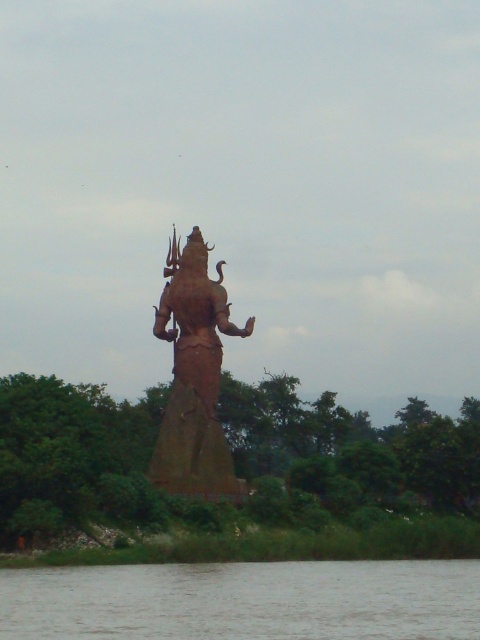
Question: Does brown water at lower center appear on the left side of rusty metal statue at center?

Choices:
 (A) no
 (B) yes

Answer: (A)

Question: Is green leafy tree at center thinner than rusty metal statue at center?

Choices:
 (A) yes
 (B) no

Answer: (B)

Question: Which object is the closest to the green leafy tree at center?

Choices:
 (A) rusty metal statue at center
 (B) brown water at lower center

Answer: (A)

Question: Which point is closer to the camera taking this photo?

Choices:
 (A) (250, 605)
 (B) (167, 426)

Answer: (A)

Question: Does green leafy tree at center lie behind brown water at lower center?

Choices:
 (A) no
 (B) yes

Answer: (B)

Question: Which is nearer to the brown water at lower center?

Choices:
 (A) rusty metal statue at center
 (B) green leafy tree at center

Answer: (B)